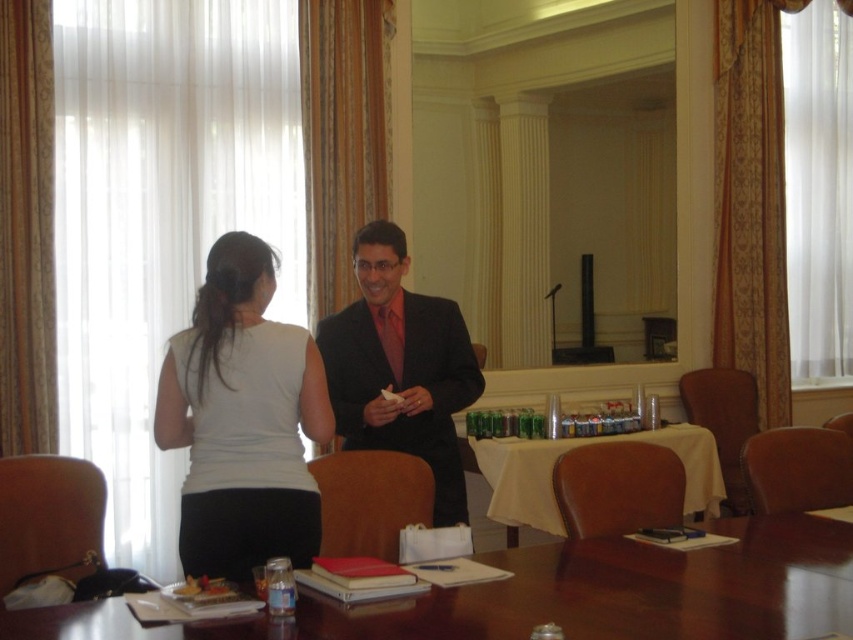
You are a photographer setting up a shoot in the conference room. You need to place a large camera on the table. Can you tell me if there is enough space on the white cloth table at center to place the camera without it overlapping the matte black suit at center?

The matte black suit at center is positioned over white cloth table at center, so placing the camera there would overlap with the suit. Move the suit or choose another spot on the table.

You are organizing a meeting in this room and need to place a tall standing lamp on the table. Which table, the shiny brown table at center or the white cloth table at center, would be more suitable for the lamp to ensure it doesn

The white cloth table at center has a greater height compared to the shiny brown table at center, so the white cloth table at center would be more suitable for placing the tall standing lamp to ensure it is stable and appropriately elevated.

From the picture: You are attending a meeting in this conference room and need to place a document on the table. Can you place the document on the white cloth table at center without it touching the white matte shirt at upper left?

The white matte shirt at upper left is above the white cloth table at center, so placing the document on the table would not cause it to touch the shirt since they are at different heights.